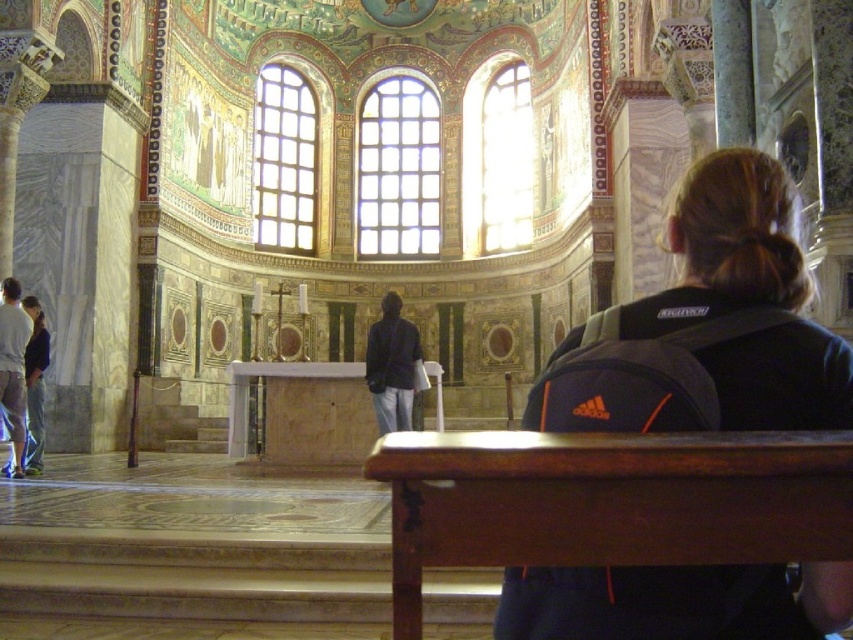
Question: Estimate the real-world distances between objects in this image. Which object is farther from the black fabric backpack at upper right?

Choices:
 (A) dark brown polished wood altar at center
 (B) smooth marble altar at center
 (C) dark blue jacket at center
 (D) light gray jeans at left

Answer: (D)

Question: Which object is farther from the camera taking this photo?

Choices:
 (A) light gray jeans at left
 (B) dark brown polished wood altar at center

Answer: (A)

Question: Is smooth marble altar at center below dark blue jacket at center?

Choices:
 (A) no
 (B) yes

Answer: (B)

Question: Is dark brown polished wood altar at center positioned at the back of denim jeans at lower left?

Choices:
 (A) yes
 (B) no

Answer: (B)

Question: Is dark brown polished wood altar at center wider than denim jeans at lower left?

Choices:
 (A) yes
 (B) no

Answer: (A)

Question: Which of these objects is positioned closest to the dark brown polished wood altar at center?

Choices:
 (A) light gray jeans at left
 (B) smooth marble altar at center
 (C) dark blue jacket at center

Answer: (B)